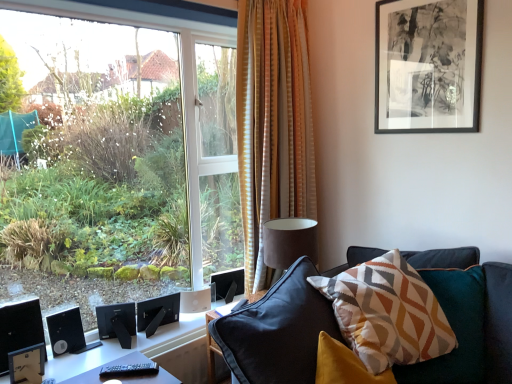
Question: Is the position of black matte speaker at lower left, which is the 3th speaker from left to right, less distant than that of geometric-patterned fabric pillow at center-right?

Choices:
 (A) no
 (B) yes

Answer: (A)

Question: Is black matte speaker at lower left, acting as the 1th speaker starting from the right, outside geometric-patterned fabric pillow at center-right?

Choices:
 (A) no
 (B) yes

Answer: (B)

Question: From the image's perspective, would you say black matte speaker at lower left, acting as the 1th speaker starting from the right, is shown under geometric-patterned fabric pillow at center-right?

Choices:
 (A) yes
 (B) no

Answer: (A)

Question: Is black matte speaker at lower left, acting as the 1th speaker starting from the right, positioned behind geometric-patterned fabric pillow at center-right?

Choices:
 (A) no
 (B) yes

Answer: (B)

Question: Is black matte speaker at lower left, acting as the 1th speaker starting from the right, oriented towards geometric-patterned fabric pillow at center-right?

Choices:
 (A) no
 (B) yes

Answer: (B)

Question: Looking at their shapes, would you say black matte picture frame at upper right is wider or thinner than striped fabric curtain at center?

Choices:
 (A) thin
 (B) wide

Answer: (A)

Question: Is black matte picture frame at upper right inside the boundaries of striped fabric curtain at center, or outside?

Choices:
 (A) inside
 (B) outside

Answer: (B)

Question: Is point (407, 39) positioned closer to the camera than point (258, 286)?

Choices:
 (A) farther
 (B) closer

Answer: (B)

Question: Considering the positions of black matte picture frame at upper right and striped fabric curtain at center in the image, is black matte picture frame at upper right taller or shorter than striped fabric curtain at center?

Choices:
 (A) tall
 (B) short

Answer: (B)

Question: From the image's perspective, relative to black matte speaker at lower left, arranged as the 3th speaker when viewed from the right, is striped fabric curtain at center above or below?

Choices:
 (A) above
 (B) below

Answer: (A)

Question: Looking at their shapes, would you say striped fabric curtain at center is wider or thinner than black matte speaker at lower left, arranged as the 3th speaker when viewed from the right?

Choices:
 (A) wide
 (B) thin

Answer: (A)

Question: Would you say striped fabric curtain at center is to the left or to the right of black matte speaker at lower left, which is the 1th speaker in left-to-right order, in the picture?

Choices:
 (A) right
 (B) left

Answer: (A)

Question: From a real-world perspective, is striped fabric curtain at center positioned above or below black matte speaker at lower left, arranged as the 3th speaker when viewed from the right?

Choices:
 (A) below
 (B) above

Answer: (B)

Question: In terms of width, does black matte speaker at lower left, acting as the second speaker starting from the left, look wider or thinner when compared to transparent glass window at left?

Choices:
 (A) thin
 (B) wide

Answer: (A)

Question: Considering their positions, is black matte speaker at lower left, the second speaker viewed from the right, located in front of or behind transparent glass window at left?

Choices:
 (A) front
 (B) behind

Answer: (B)